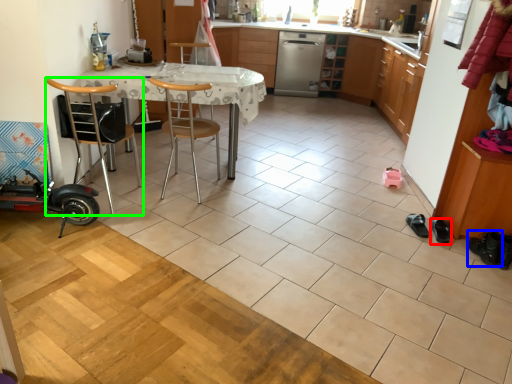
Question: Which is nearer to the footwear (highlighted by a red box)? footwear (highlighted by a blue box) or chair (highlighted by a green box).

Choices:
 (A) footwear
 (B) chair

Answer: (A)